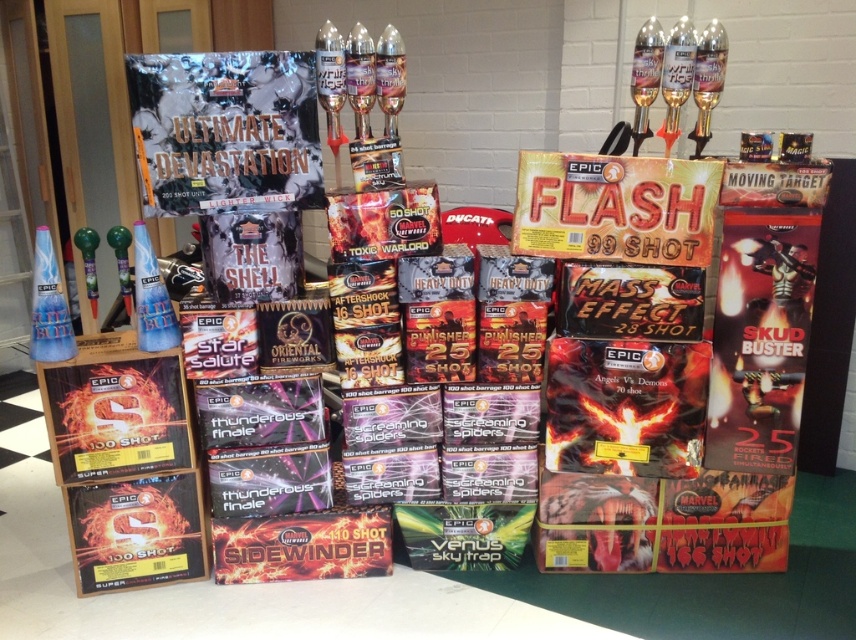
Question: From the image, what is the correct spatial relationship of matte black comic book at upper left in relation to matte black box at lower left?

Choices:
 (A) above
 (B) below

Answer: (A)

Question: Among these points, which one is farthest from the camera?

Choices:
 (A) (224, 109)
 (B) (62, 365)

Answer: (B)

Question: Does matte black comic book at upper left appear over matte black box at lower left?

Choices:
 (A) yes
 (B) no

Answer: (A)

Question: Which object appears closest to the camera in this image?

Choices:
 (A) matte black comic book at upper left
 (B) matte black box at lower left

Answer: (A)

Question: Is matte black comic book at upper left to the right of matte black box at lower left from the viewer's perspective?

Choices:
 (A) no
 (B) yes

Answer: (B)

Question: Among these objects, which one is farthest from the camera?

Choices:
 (A) matte black box at lower left
 (B) matte black comic book at upper left

Answer: (A)